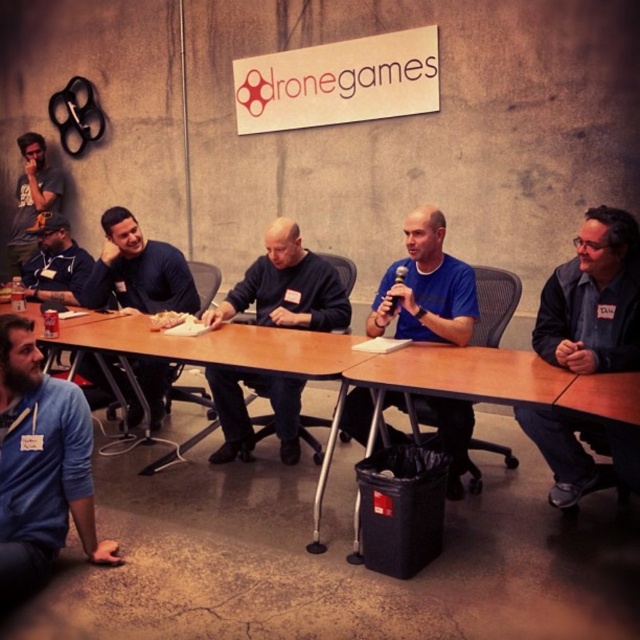
You are standing in front of the table and want to reach both the point at coordinates point [58,381] and point [166,259]. Which point should you touch first?

You should touch point [58,381] first because it is closer to you than point [166,259].

You are organizing a small event and need to place a 12 inch wide decorative plate between the blue denim jacket at right and the wooden table at lower right. Based on the available space, will the plate fit comfortably without overlapping either object?

The distance between the blue denim jacket at right and the wooden table at lower right is 14.18 inches. Since the plate is 12 inches wide, there is enough space for it to fit comfortably without overlapping either object.

You are organizing a charity event and need to display two blue sweaters on a stand. The stand has two hooks separated by 30 cm. The blue sweater at lower left and the matte blue sweater at left are available. Which sweater should you choose to ensure it fits comfortably on the hook without overlapping the other?

The blue sweater at lower left has a smaller width than the matte blue sweater at left. Since the hooks are separated by 30 cm, the blue sweater at lower left would fit comfortably without overlapping the other sweater.